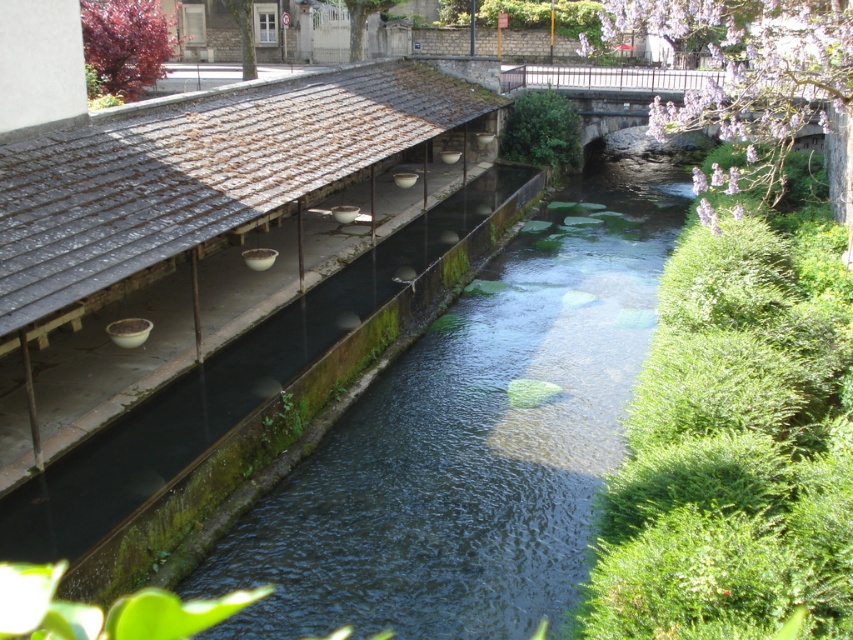
Describe the element at coordinates (471, 440) in the screenshot. The image size is (853, 640). I see `green mossy concrete at left` at that location.

Can you confirm if green mossy concrete at left is shorter than green mossy concrete at center?

Indeed, green mossy concrete at left has a lesser height compared to green mossy concrete at center.

Which is behind, point (486, 582) or point (235, 388)?

The point (235, 388) is behind.

You are a GUI agent. You are given a task and a screenshot of the screen. Output one action in this format:
    pyautogui.click(x=<x>, y=<y>)
    Task: Click on the green mossy concrete at left
    Image resolution: width=853 pixels, height=640 pixels.
    Given the screenshot: What is the action you would take?
    pyautogui.click(x=471, y=440)